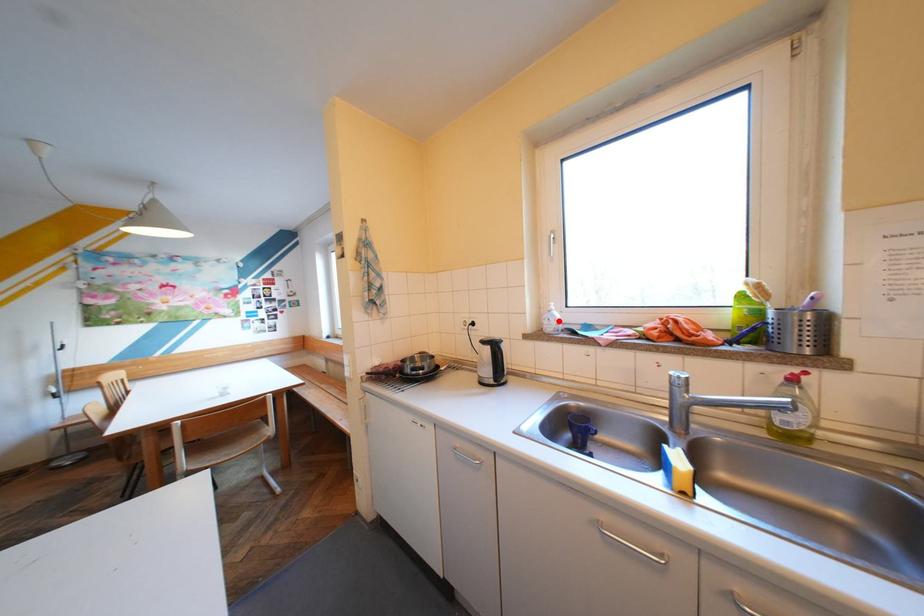
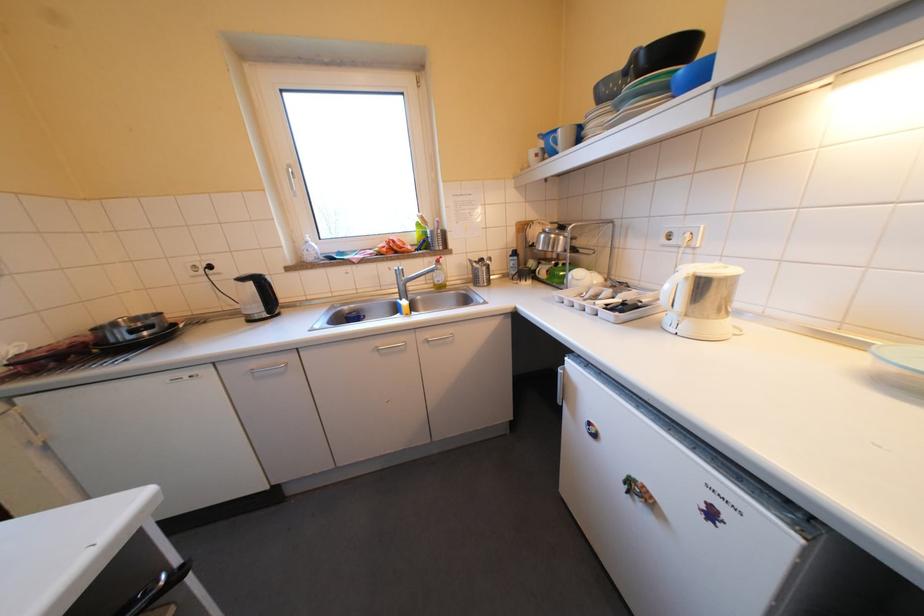
Question: I am providing you with two images of the same scene from different viewpoints. A red point is shown in image1. For the corresponding object point in image2, is it positioned nearer or farther from the camera?

Choices:
 (A) Nearer
 (B) Farther

Answer: (A)